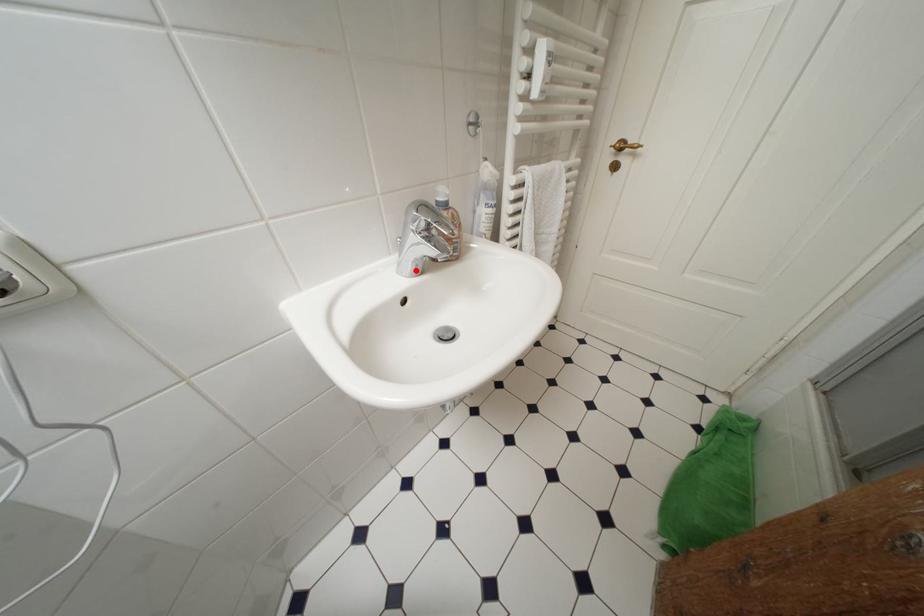
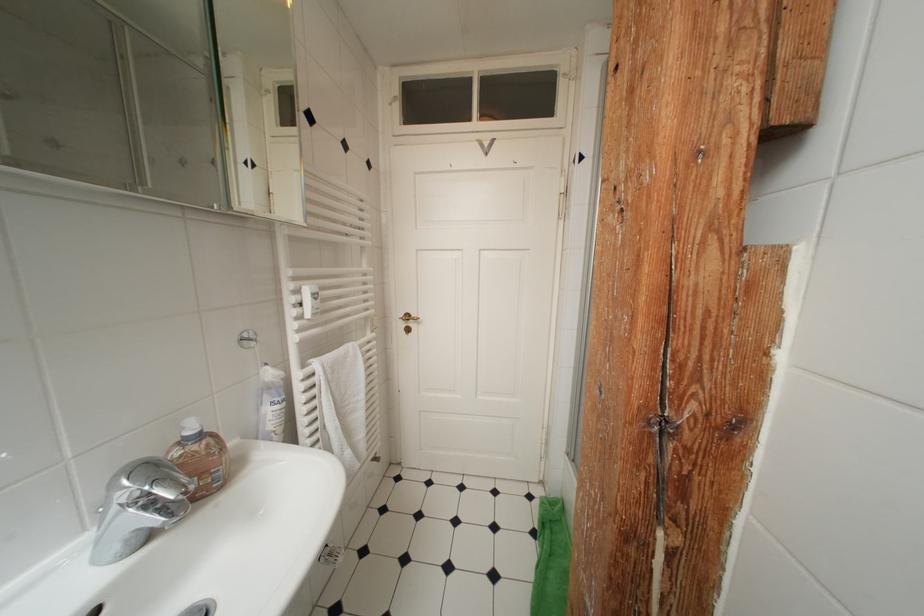
Find the pixel in the second image that matches the highlighted location in the first image.

(124, 551)